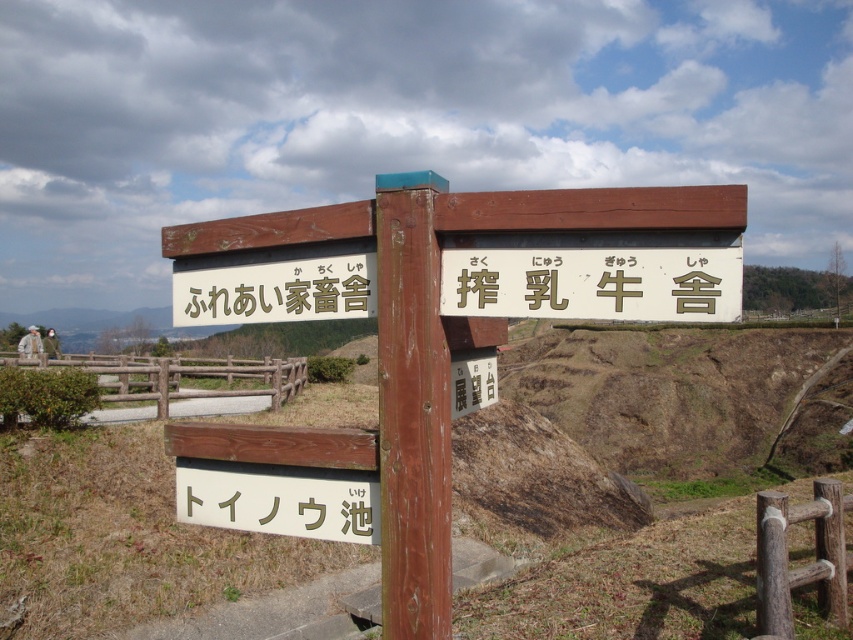
Question: Considering the relative positions of white wood sign at lower center and brown wooden sign at center in the image provided, where is white wood sign at lower center located with respect to brown wooden sign at center?

Choices:
 (A) below
 (B) above

Answer: (A)

Question: Among these objects, which one is farthest from the camera?

Choices:
 (A) brown wooden sign at center
 (B) wooden post at center
 (C) white wood sign at lower center
 (D) wooden sign at center

Answer: (A)

Question: Is the position of wooden sign at center more distant than that of wooden post at center?

Choices:
 (A) no
 (B) yes

Answer: (A)

Question: Among these points, which one is nearest to the camera?

Choices:
 (A) (496, 381)
 (B) (444, 451)

Answer: (B)

Question: Is the position of wooden post at center less distant than that of brown wooden sign at center?

Choices:
 (A) yes
 (B) no

Answer: (A)

Question: Which point is farther from the camera taking this photo?

Choices:
 (A) (494, 396)
 (B) (316, 522)
 (C) (267, 461)
 (D) (398, 541)

Answer: (A)